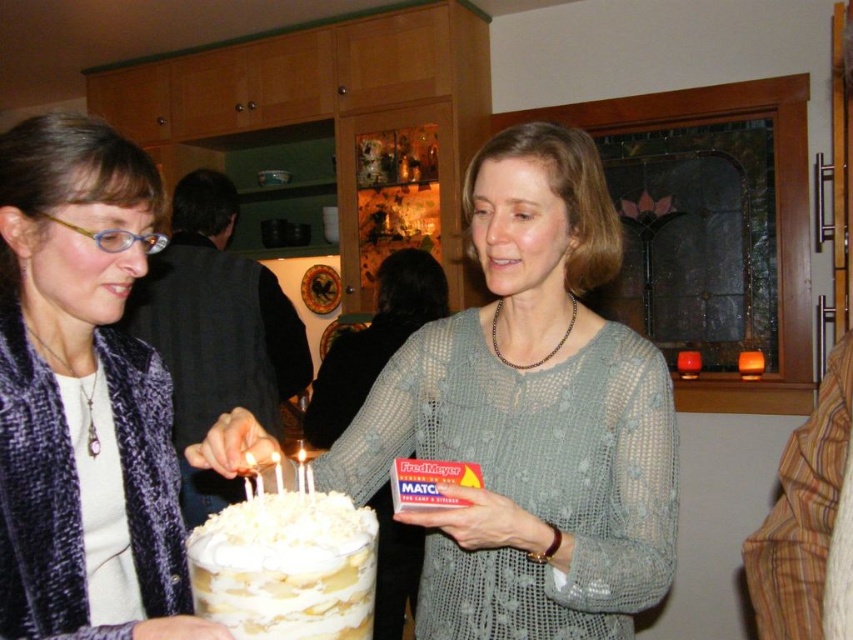
Question: Does knitted gray sweater at center come behind white wax candle at center?

Choices:
 (A) no
 (B) yes

Answer: (A)

Question: Among these objects, which one is farthest from the camera?

Choices:
 (A) purple textured jacket at lower left
 (B) white fluffy cake at center
 (C) matte gray sweater at center

Answer: (C)

Question: Which object is the closest to the knitted gray sweater at center?

Choices:
 (A) white wax candle at center
 (B) purple textured jacket at lower left
 (C) white fluffy cake at center
 (D) matte gray sweater at center

Answer: (A)

Question: Observing the image, what is the correct spatial positioning of matte gray sweater at center in reference to knitted gray sweater at center?

Choices:
 (A) left
 (B) right

Answer: (B)

Question: Among these points, which one is farthest from the camera?

Choices:
 (A) (190, 564)
 (B) (297, 461)

Answer: (B)

Question: Is knitted gray sweater at center closer to camera compared to white wax candle at center?

Choices:
 (A) yes
 (B) no

Answer: (A)